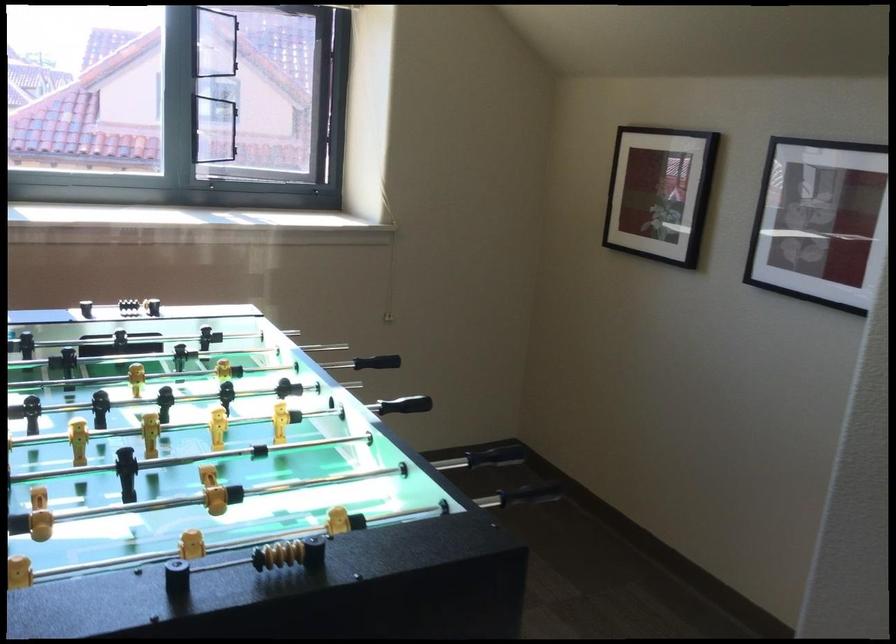
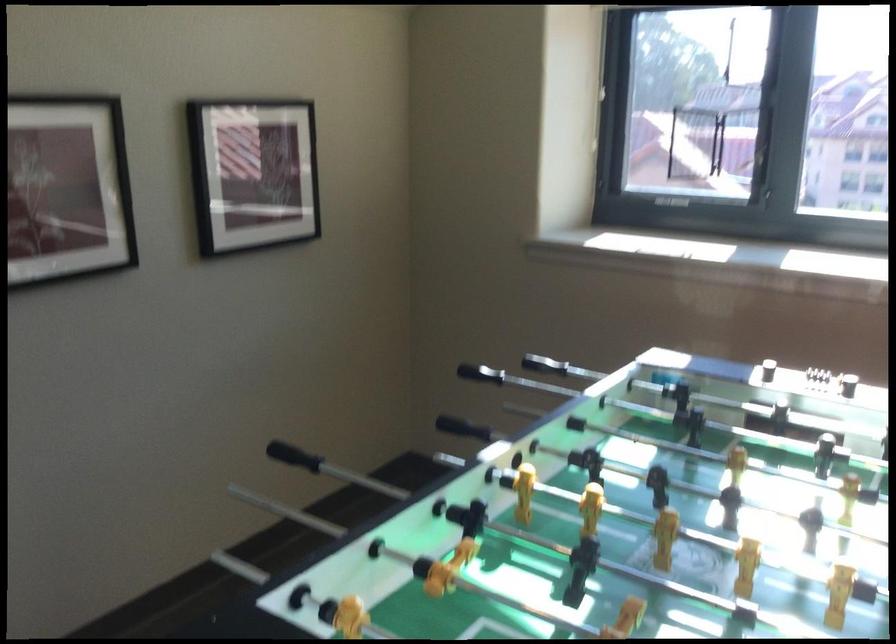
Question: The images are taken continuously from a first-person perspective. In which direction is your viewpoint rotating?

Choices:
 (A) Left
 (B) Right
 (C) Up
 (D) Down

Answer: (A)